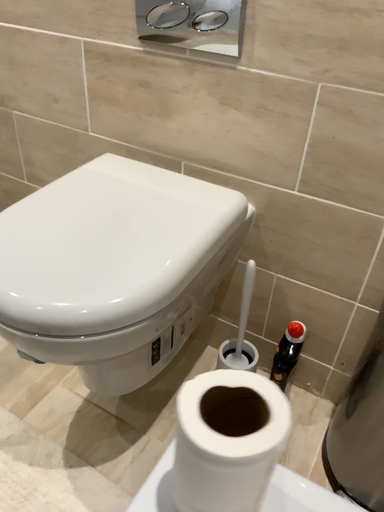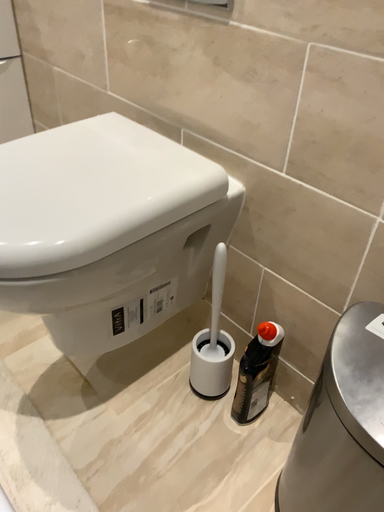
Question: Which way did the camera rotate in the video?

Choices:
 (A) rotated right
 (B) rotated left

Answer: (B)